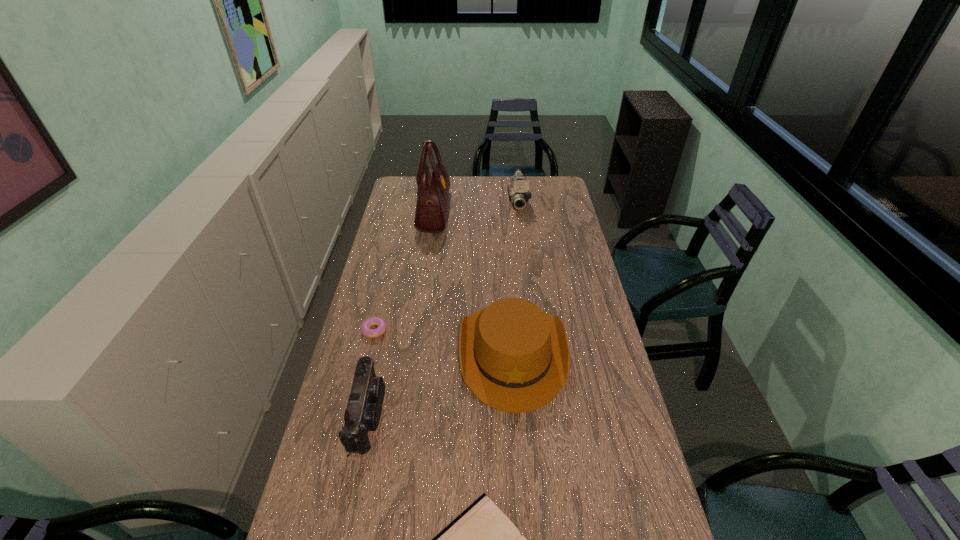
Locate an element on the screen. Image resolution: width=960 pixels, height=540 pixels. handbag is located at coordinates (433, 181).

This screenshot has height=540, width=960. What are the coordinates of `the farther camcorder` in the screenshot? It's located at (518, 192).

Identify the location of the right camcorder. (518, 192).

Locate an element on the screen. The width and height of the screenshot is (960, 540). cowboy hat is located at coordinates (515, 358).

I want to click on the nearer camcorder, so click(364, 405).

Where is `the left camcorder`? the left camcorder is located at coordinates (364, 405).

The image size is (960, 540). Find the location of `doughnut`. doughnut is located at coordinates (371, 333).

The image size is (960, 540). Identify the location of vacant space located on the front-facing side of the handbag. (464, 211).

Image resolution: width=960 pixels, height=540 pixels. Find the location of `vacant space situated on the front-facing side of the taller camcorder`. vacant space situated on the front-facing side of the taller camcorder is located at coordinates (524, 241).

Locate an element on the screen. free space located on the front-facing side of the cowboy hat is located at coordinates (522, 496).